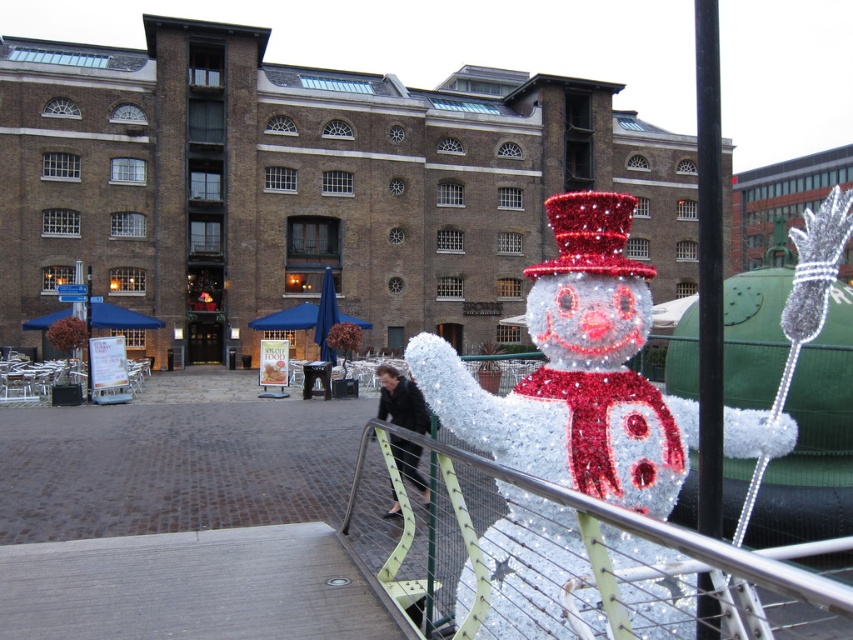
You are a delivery drone that is 1.5 meters tall. You need to fly over the metallic silver fence at lower right to deliver a package to the area near the iridescent plastic snowman at center. Can you safely pass over the fence without hitting it?

The iridescent plastic snowman at center is taller than the metallic silver fence at lower right. Since the drone is 1.5 meters tall, it can safely pass over the fence as the snowman is taller, implying the fence is shorter than 1.5 meters.

You are standing at the snowman decoration and want to walk towards the building. There are two points marked on the ground in front of you. One is at point (589, 513) and the other is at point (704, 328). Which point is closer to you as you face the building?

Point (589, 513) is in front of point (704, 328), so it is closer to you as you face the building.

You are a delivery person trying to navigate through the festive area. You need to place a small package between the metallic silver fence at lower right and the black metal pole at right. Is there enough space between them for the package?

The metallic silver fence at lower right is positioned under the black metal pole at right, meaning they are vertically aligned. Since the package is small, it can be placed between them as there is space between the vertical structures.